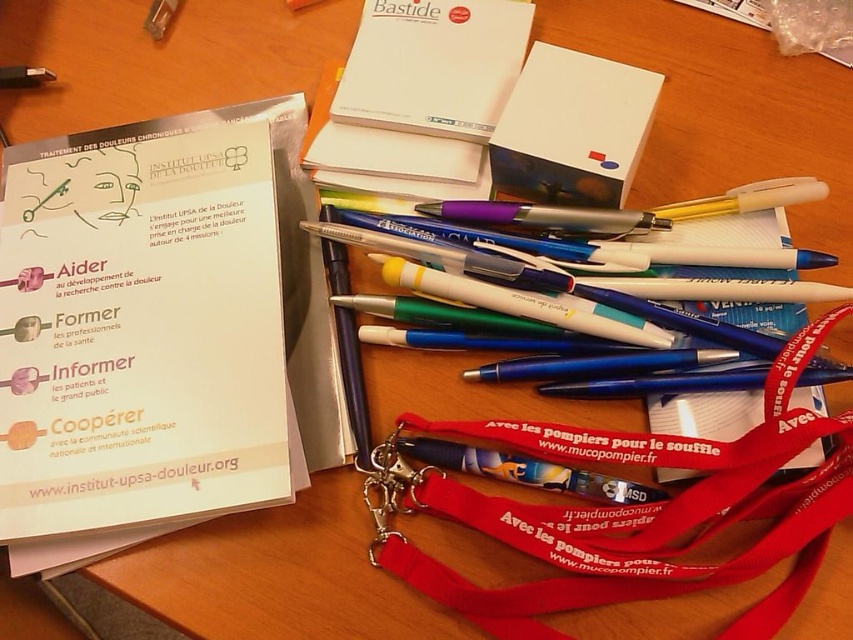
You are organizing the desk and need to place a new 10 inch wide folder between the red fabric lanyard at center and the white paper notepad at upper center. Can the folder fit in the space between them?

The red fabric lanyard at center is 12.23 inches away from the white paper notepad at upper center. Since the folder is 10 inches wide, there is enough space to place it between them.

You are organizing the desk and need to place the red fabric lanyard at center and white paper notepad at upper center. According to their current positions, where should you place them to maintain their original spatial relationship?

The red fabric lanyard at center should be placed under the white paper notepad at upper center to maintain their original spatial relationship.

You are a delivery person who needs to place a new package on the desk. The package is 17 inches long. You see the point at coordinates point (601, 525). Can you place the package horizontally from the edge of the desk to this point?

The distance between the edge of the desk and point (601, 525) is 16.94 inches. Since the package is 17 inches long, it won not fit as the distance is slightly shorter than the package length.